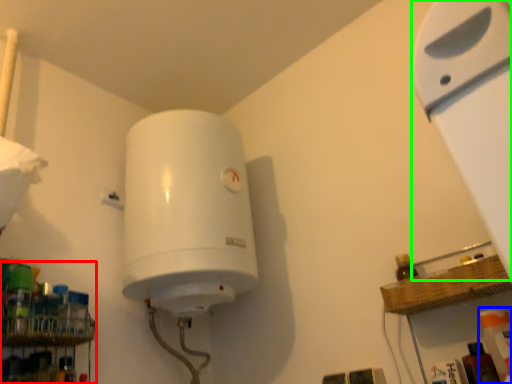
Question: Which object is the closest to the shelf (highlighted by a red box)? Choose among these: cleaning product (highlighted by a blue box) or wide (highlighted by a green box).

Choices:
 (A) cleaning product
 (B) wide

Answer: (A)